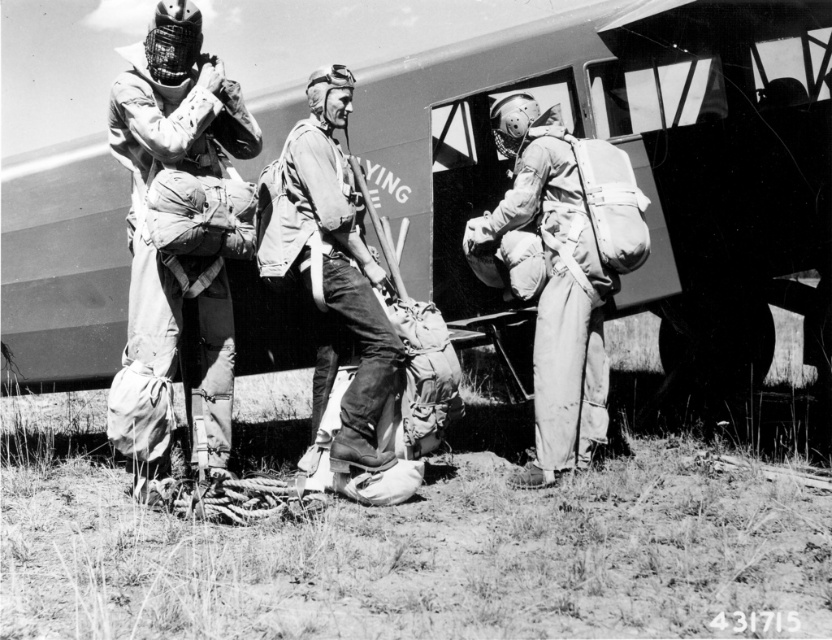
You are a member of this group and need to reach the metallic fuselage at center to secure some equipment. Considering your average walking distance per step is 2.5 feet, how many steps would you need to take to reach it?

The metallic fuselage at center is 13.96 feet away from the viewer. Since each step covers 2.5 feet, dividing 13.96 by 2.5 gives approximately 5.584 steps. Since you can only take whole steps, you would need to take 6 steps to reach the metallic fuselage at center.

You are a military planner trying to fit two soldiers into a narrow escape pod. The escape pod can only accommodate a soldier whose uniform is narrower than 1.2 meters. You have a matte khaki jumpsuit at left and a matte khaki uniform at center. Which one is more likely to fit inside the escape pod?

The matte khaki jumpsuit at left is narrower than the matte khaki uniform at center, so the matte khaki jumpsuit at left is more likely to fit inside the escape pod since its width is less than 1.2 meters.

You are a photographer at the airfield and need to capture a photo of the matte khaki jumpsuit at left and the matte khaki uniform at center. Based on their sizes, which one should you focus on first to ensure they both fit in the frame?

The matte khaki jumpsuit at left is larger than the matte khaki uniform at center, so you should focus on the matte khaki jumpsuit at left first to ensure it fits in the frame, and then adjust to include the smaller matte khaki uniform at center.